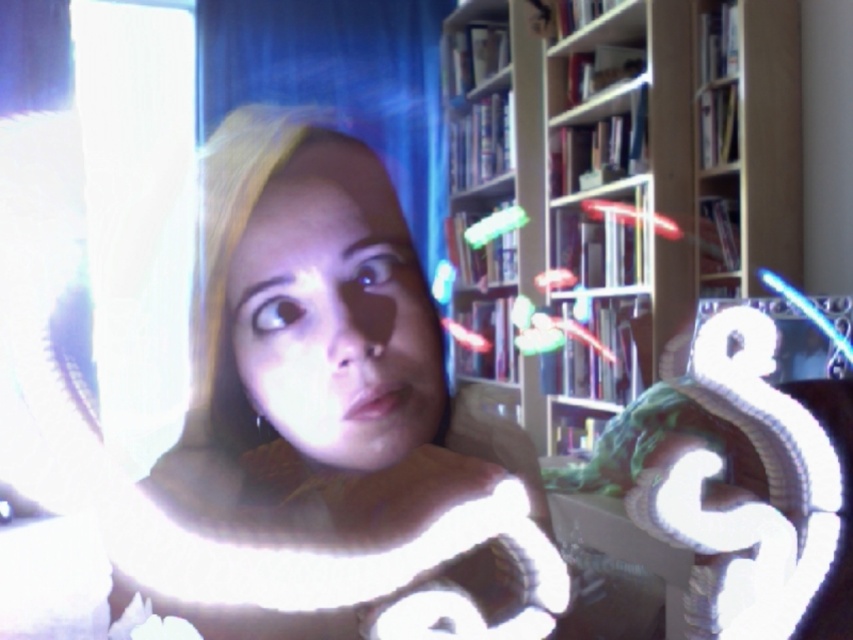
Question: Can you confirm if wooden bookshelf at center is thinner than matte skin face at center?

Choices:
 (A) no
 (B) yes

Answer: (A)

Question: Does wooden bookshelf at center have a smaller size compared to matte skin face at center?

Choices:
 (A) no
 (B) yes

Answer: (A)

Question: Among these points, which one is nearest to the camera?

Choices:
 (A) (332, 342)
 (B) (527, 381)
 (C) (395, 624)

Answer: (C)

Question: Which object appears farthest from the camera in this image?

Choices:
 (A) wooden bookshelf at center
 (B) matte white scarf at center

Answer: (A)

Question: Does matte white scarf at center appear on the left side of matte skin face at center?

Choices:
 (A) yes
 (B) no

Answer: (A)

Question: Among these objects, which one is farthest from the camera?

Choices:
 (A) matte white scarf at center
 (B) matte skin face at center

Answer: (B)